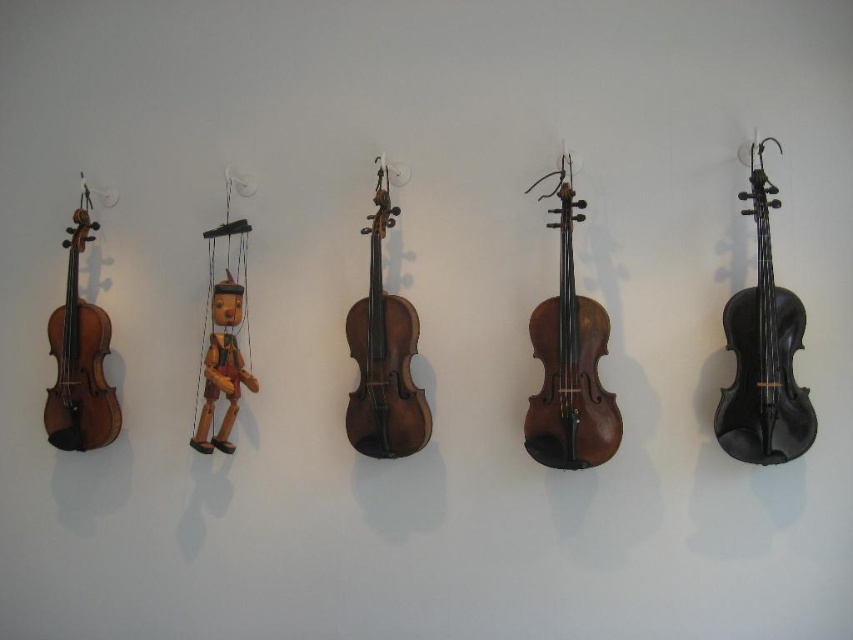
You are an art installer who needs to adjust the spacing between the dark brown wood cello at center and the wooden violin at center so that they are equally distant from the wall. Currently, which one is closer to the wall?

The dark brown wood cello at center is positioned under the wooden violin at center, meaning the wooden violin at center is closer to the wall. Therefore, the wooden violin at center needs to be moved away to match the distance of the dark brown wood cello at center.

Consider the image. You are an art installer adjusting the positions of two points on a wall. The points are labeled as point (49, 353) and point (219, 300). Which point is closer to you when you face the wall?

Point (49, 353) is closer to you than point (219, 300) because it is further to the viewer.

Looking at the arrangement of the dark brown wood cello at center and the wooden violin at center on the wall, which one is positioned to the right of the other?

The dark brown wood cello at center is positioned to the right of the wooden violin at center.